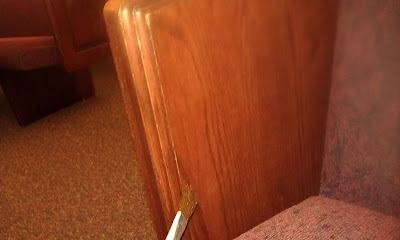
The height and width of the screenshot is (240, 400). I want to click on corner between wooden panels, so click(x=334, y=40), click(x=321, y=164).